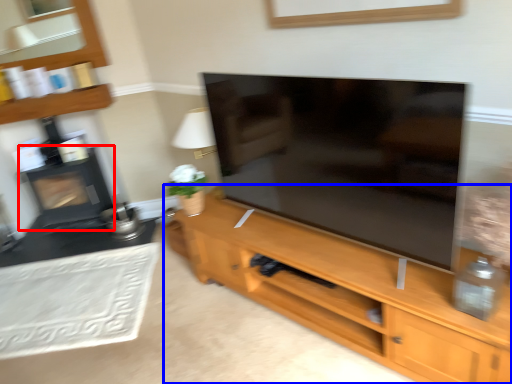
Question: Which object is closer to the camera taking this photo, fireplace (highlighted by a red box) or cupboard (highlighted by a blue box)?

Choices:
 (A) fireplace
 (B) cupboard

Answer: (B)